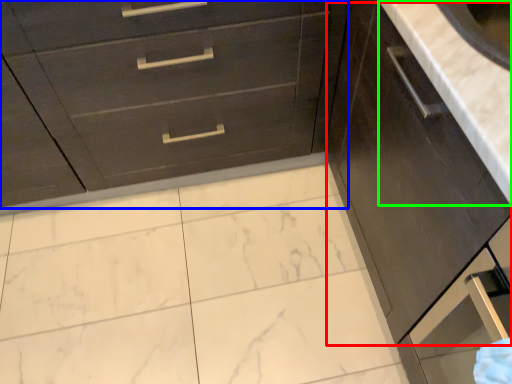
Question: Based on their relative distances, which object is farther from cabinetry (highlighted by a red box)? Choose from chest of drawers (highlighted by a blue box) and counter top (highlighted by a green box).

Choices:
 (A) chest of drawers
 (B) counter top

Answer: (A)